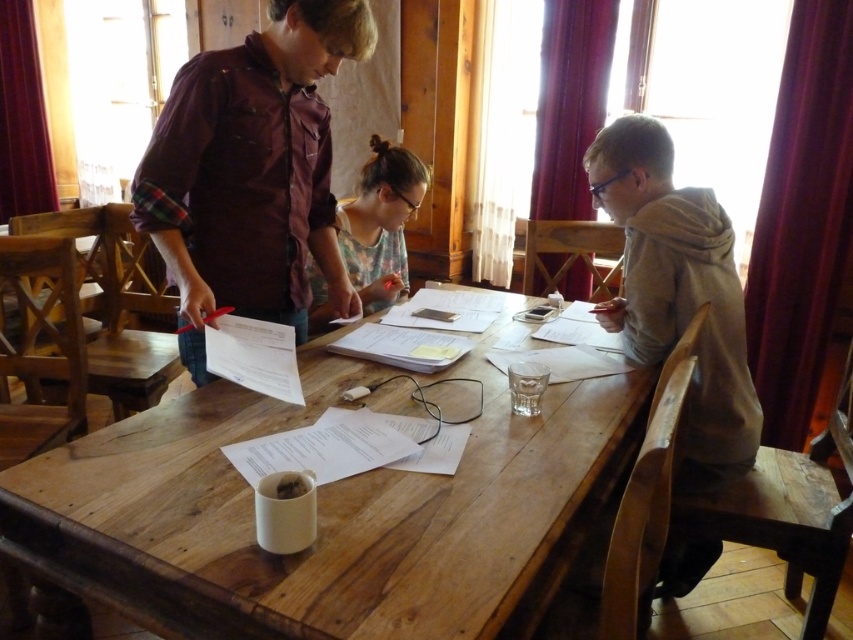
Consider the image. Can you confirm if wooden table at center is positioned to the right of floral fabric shirt at center?

Correct, you'll find wooden table at center to the right of floral fabric shirt at center.

Who is higher up, wooden table at center or floral fabric shirt at center?

floral fabric shirt at center is higher up.

You are a GUI agent. You are given a task and a screenshot of the screen. Output one action in this format:
    pyautogui.click(x=<x>, y=<y>)
    Task: Click on the wooden table at center
    
    Given the screenshot: What is the action you would take?
    pyautogui.click(x=325, y=515)

Between gray matte hoodie at right and floral fabric shirt at center, which one appears on the left side from the viewer's perspective?

floral fabric shirt at center is more to the left.

Does gray matte hoodie at right appear on the left side of floral fabric shirt at center?

No, gray matte hoodie at right is not to the left of floral fabric shirt at center.

Image resolution: width=853 pixels, height=640 pixels. Identify the location of gray matte hoodie at right. (677, 291).

Is wooden table at center below gray matte hoodie at right?

Yes, wooden table at center is below gray matte hoodie at right.

What do you see at coordinates (325, 515) in the screenshot? This screenshot has height=640, width=853. I see `wooden table at center` at bounding box center [325, 515].

Locate an element on the screen. wooden table at center is located at coordinates (325, 515).

Locate an element on the screen. The image size is (853, 640). wooden table at center is located at coordinates (325, 515).